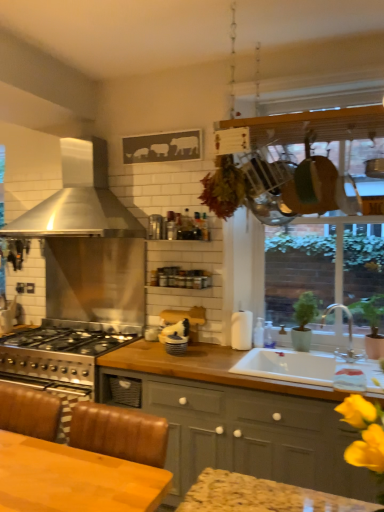
What is the approximate width of green matte plant at sink, which is counted as the second plant, starting from the right?

green matte plant at sink, which is counted as the second plant, starting from the right, is 6.15 inches in width.

Locate an element on the screen. silver metallic faucet at sink right is located at coordinates (348, 334).

Measure the distance between point (185, 341) and camera.

Point (185, 341) is 8.36 feet away from camera.

Describe the element at coordinates (370, 311) in the screenshot. I see `green matte plant at right, acting as the first plant starting from the right` at that location.

The height and width of the screenshot is (512, 384). What are the coordinates of `green matte plant at sink, which is counted as the second plant, starting from the right` in the screenshot? It's located at (305, 309).

Considering the relative sizes of white ceramic sink at lower right and white glossy jar at center, the third appliance in the back-to-front sequence, in the image provided, is white ceramic sink at lower right taller than white glossy jar at center, the third appliance in the back-to-front sequence,?

No, white ceramic sink at lower right is not taller than white glossy jar at center, the third appliance in the back-to-front sequence.

Does white ceramic sink at lower right have a lesser width compared to white glossy jar at center, the third appliance in the back-to-front sequence?

No.

Is white ceramic sink at lower right further to the viewer compared to white glossy jar at center, the first appliance viewed from the front?

No, white ceramic sink at lower right is closer to the camera.

Between silver metallic faucet at sink right and stainless steel range hood at left, which one is positioned in front?

silver metallic faucet at sink right is in front.

Does point (340, 305) appear closer or farther from the camera than point (70, 170)?

Point (340, 305) appears to be closer to the viewer than point (70, 170).

Are silver metallic faucet at sink right and stainless steel range hood at left beside each other?

No, silver metallic faucet at sink right is not in contact with stainless steel range hood at left.

Is wooden table at lower left inside or outside of white paper towel dispenser at center, the first appliance when ordered from right to left?

wooden table at lower left cannot be found inside white paper towel dispenser at center, the first appliance when ordered from right to left.

Between wooden table at lower left and white paper towel dispenser at center, arranged as the third appliance when viewed from the left, which one appears on the right side from the viewer's perspective?

white paper towel dispenser at center, arranged as the third appliance when viewed from the left, is more to the right.

From the image's perspective, is wooden table at lower left above white paper towel dispenser at center, the first appliance when ordered from right to left?

Incorrect, from the image's perspective, wooden table at lower left is lower than white paper towel dispenser at center, the first appliance when ordered from right to left.

Does white ceramic sink at lower right appear on the right side of stainless steel range hood at left?

Correct, you'll find white ceramic sink at lower right to the right of stainless steel range hood at left.

Choose the correct answer: Is white ceramic sink at lower right inside stainless steel range hood at left or outside it?

white ceramic sink at lower right exists outside the volume of stainless steel range hood at left.

In the scene shown: Could you tell me if white ceramic sink at lower right is turned towards stainless steel range hood at left?

No, white ceramic sink at lower right is not turned towards stainless steel range hood at left.

From the image's perspective, who appears lower, white ceramic sink at lower right or stainless steel range hood at left?

white ceramic sink at lower right is shown below in the image.

Measure the distance between wooden table at lower left and white glossy jar at center, the 2th appliance in the right-to-left sequence.

wooden table at lower left and white glossy jar at center, the 2th appliance in the right-to-left sequence, are 4.49 feet apart.

From the image's perspective, does wooden table at lower left appear lower than white glossy jar at center, marked as the 1th appliance in a bottom-to-top arrangement?

Correct, wooden table at lower left appears lower than white glossy jar at center, marked as the 1th appliance in a bottom-to-top arrangement, in the image.

Is wooden table at lower left facing away from white glossy jar at center, the first appliance viewed from the front?

Yes, white glossy jar at center, the first appliance viewed from the front, is at the back of wooden table at lower left.

Is white ceramic sink at lower right spatially inside wooden frame at upper right, or outside of it?

white ceramic sink at lower right is not enclosed by wooden frame at upper right.

Considering the sizes of objects white ceramic sink at lower right and wooden frame at upper right in the image provided, who is bigger, white ceramic sink at lower right or wooden frame at upper right?

Bigger between the two is wooden frame at upper right.

Identify the location of sink in front of the wooden frame at upper right. Image resolution: width=384 pixels, height=512 pixels. [302, 367].

Can you confirm if matte gray cabinets at center is taller than green matte plant at right, acting as the first plant starting from the right?

Yes.

Which point is more distant from viewer, (337, 440) or (382, 298)?

Point (382, 298)

Considering the sizes of objects matte gray cabinets at center and green matte plant at right, which is counted as the second plant, starting from the left, in the image provided, who is bigger, matte gray cabinets at center or green matte plant at right, which is counted as the second plant, starting from the left,?

With larger size is matte gray cabinets at center.

Could you tell me if matte gray cabinets at center is facing green matte plant at right, which is counted as the second plant, starting from the left?

No, matte gray cabinets at center is not turned towards green matte plant at right, which is counted as the second plant, starting from the left.

From the white ceramic sink at lower right, count 1st appliances backward and point to it. Please provide its 2D coordinates.

[(176, 344)]

In order to click on tap lying below the stainless steel range hood at left (from the image's perspective) in this screenshot , I will do `click(348, 334)`.

Estimate the real-world distances between objects in this image. Which object is further from white paper towel dispenser at center, the first appliance when ordered from right to left, matte gray cabinets at center or stainless steel range hood at left?

Based on the image, stainless steel range hood at left appears to be further to white paper towel dispenser at center, the first appliance when ordered from right to left.

Estimate the real-world distances between objects in this image. Which object is closer to metallic silver spice rack at upper center, which ranks as the 1th appliance in left-to-right order, white glossy jar at center, which is the 3th appliance in top-to-bottom order, or white paper towel dispenser at center, the second appliance in the bottom-to-top sequence?

Based on the image, white glossy jar at center, which is the 3th appliance in top-to-bottom order, appears to be nearer to metallic silver spice rack at upper center, which ranks as the 1th appliance in left-to-right order.

From the picture: When comparing their distances from white ceramic sink at lower right, does silver metallic faucet at sink right or green matte plant at right, which is counted as the second plant, starting from the left, seem closer?

silver metallic faucet at sink right lies closer to white ceramic sink at lower right than the other object.

Estimate the real-world distances between objects in this image. Which object is closer to white paper towel dispenser at center, acting as the second appliance starting from the top, stainless steel range hood at left or wooden frame at upper right?

wooden frame at upper right lies closer to white paper towel dispenser at center, acting as the second appliance starting from the top, than the other object.

Considering their positions, is silver metallic faucet at sink right positioned further to wooden frame at upper right than white paper towel dispenser at center, arranged as the third appliance when viewed from the left?

white paper towel dispenser at center, arranged as the third appliance when viewed from the left, lies further to wooden frame at upper right than the other object.

When comparing their distances from green matte plant at sink, which is counted as the second plant, starting from the right, does stainless steel range hood at left or white paper towel dispenser at center, marked as the second appliance in a front-to-back arrangement, seem closer?

white paper towel dispenser at center, marked as the second appliance in a front-to-back arrangement.

Based on their spatial positions, is white paper towel dispenser at center, marked as the second appliance in a front-to-back arrangement, or green matte plant at right, acting as the first plant starting from the right, further from metallic silver spice rack at upper center, the third appliance when ordered from front to back?

Based on the image, green matte plant at right, acting as the first plant starting from the right, appears to be further to metallic silver spice rack at upper center, the third appliance when ordered from front to back.

Based on their spatial positions, is wooden frame at upper right or white paper towel dispenser at center, placed as the 2th appliance when sorted from back to front, further from silver metallic faucet at sink right?

wooden frame at upper right lies further to silver metallic faucet at sink right than the other object.

Image resolution: width=384 pixels, height=512 pixels. What are the coordinates of `appliance located between white glossy jar at center, the first appliance viewed from the front, and silver metallic faucet at sink right in the left-right direction` in the screenshot? It's located at (241, 330).

What are the coordinates of `window frame between wooden table at lower left and green matte plant at right, acting as the first plant starting from the right` in the screenshot? It's located at (309, 159).

Find the location of a particular element. The height and width of the screenshot is (512, 384). tap between wooden table at lower left and white paper towel dispenser at center, acting as the second appliance starting from the top, from front to back is located at coordinates (348, 334).

Where is `tap between green matte plant at sink, which is counted as the second plant, starting from the right, and matte gray cabinets at center vertically`? tap between green matte plant at sink, which is counted as the second plant, starting from the right, and matte gray cabinets at center vertically is located at coordinates (348, 334).